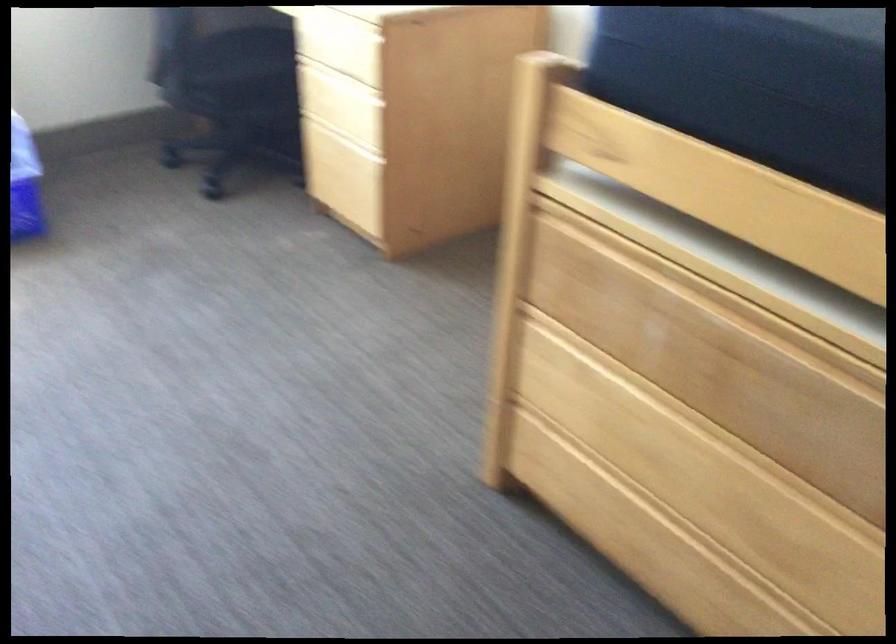
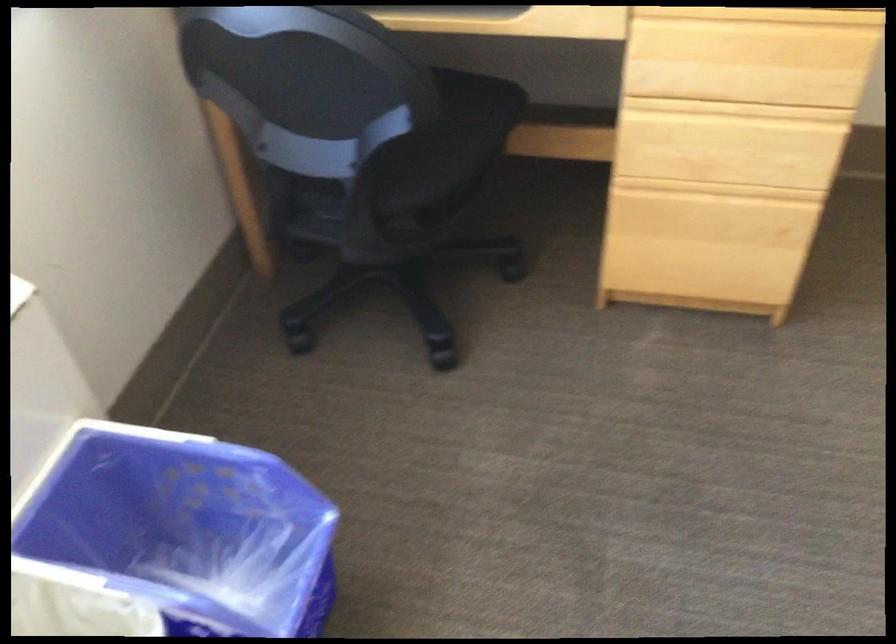
The point at (348, 134) is marked in the first image. Where is the corresponding point in the second image?

(718, 190)